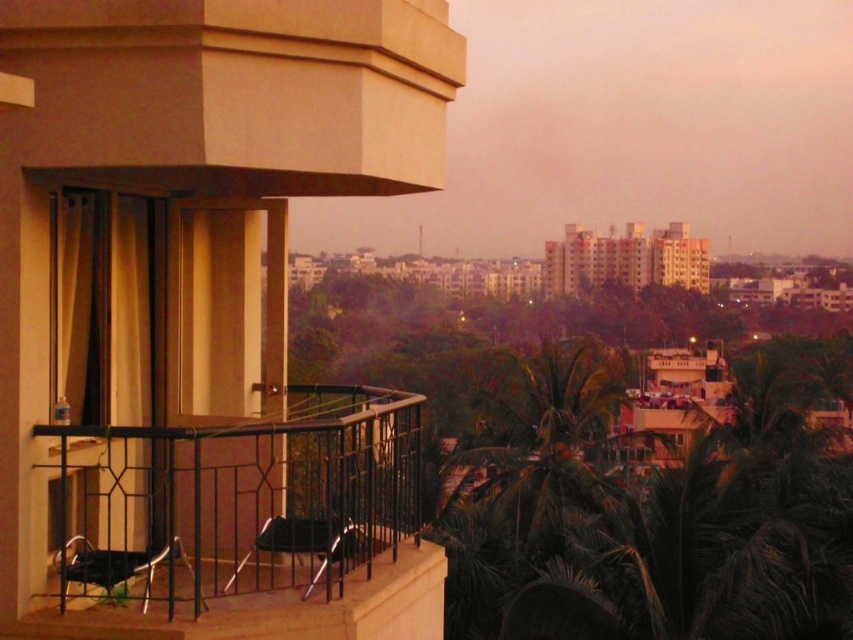
You are standing on the balcony and want to place a small potted plant between the matte black balcony at center and the black metal railing at lower left. Which object should the plant be closer to according to their positions?

The matte black balcony at center is closer to the viewer than the black metal railing at lower left, so the plant should be placed closer to the black metal railing at lower left to maintain the spatial arrangement.

You are planning to place a small potted plant on the balcony. Given the sizes of the matte black balcony at center and the metallic black chair at center, which object would be more suitable for placing the plant to ensure it has enough space?

The matte black balcony at center has a larger size compared to the metallic black chair at center, so placing the plant on the balcony would provide more space.